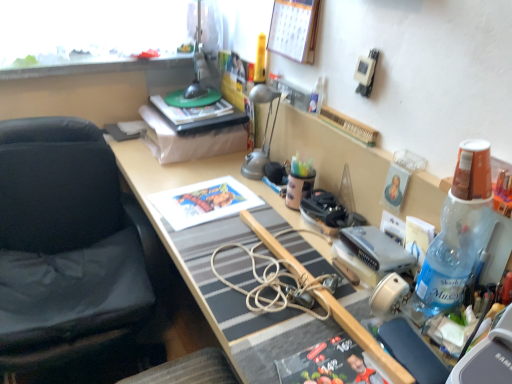
Question: Is matte paper print at center located outside hardcover book at center?

Choices:
 (A) yes
 (B) no

Answer: (A)

Question: Is matte paper print at center smaller than hardcover book at center?

Choices:
 (A) no
 (B) yes

Answer: (B)

Question: From the image's perspective, is matte paper print at center on top of hardcover book at center?

Choices:
 (A) yes
 (B) no

Answer: (B)

Question: Can you confirm if matte paper print at center is positioned to the left of hardcover book at center?

Choices:
 (A) no
 (B) yes

Answer: (A)

Question: Considering the relative sizes of matte paper print at center and hardcover book at center in the image provided, is matte paper print at center wider than hardcover book at center?

Choices:
 (A) yes
 (B) no

Answer: (A)

Question: Relative to matte paper print at center, is wooden calendar at upper center in front or behind?

Choices:
 (A) behind
 (B) front

Answer: (B)

Question: Is wooden calendar at upper center situated inside matte paper print at center or outside?

Choices:
 (A) outside
 (B) inside

Answer: (A)

Question: From a real-world perspective, relative to matte paper print at center, is wooden calendar at upper center vertically above or below?

Choices:
 (A) below
 (B) above

Answer: (B)

Question: Considering the positions of point (273, 19) and point (227, 188), is point (273, 19) closer or farther from the camera than point (227, 188)?

Choices:
 (A) farther
 (B) closer

Answer: (B)

Question: Based on their sizes in the image, would you say matte paper print at center is bigger or smaller than wooden desk at center?

Choices:
 (A) big
 (B) small

Answer: (B)

Question: In the image, is matte paper print at center on the left side or the right side of wooden desk at center?

Choices:
 (A) right
 (B) left

Answer: (B)

Question: From a real-world perspective, is matte paper print at center above or below wooden desk at center?

Choices:
 (A) above
 (B) below

Answer: (A)

Question: Choose the correct answer: Is matte paper print at center inside wooden desk at center or outside it?

Choices:
 (A) inside
 (B) outside

Answer: (A)

Question: Does point (403, 266) appear closer or farther from the camera than point (301, 24)?

Choices:
 (A) farther
 (B) closer

Answer: (B)

Question: Considering the positions of silver metallic game console at center-right and wooden calendar at upper center in the image, is silver metallic game console at center-right taller or shorter than wooden calendar at upper center?

Choices:
 (A) short
 (B) tall

Answer: (A)